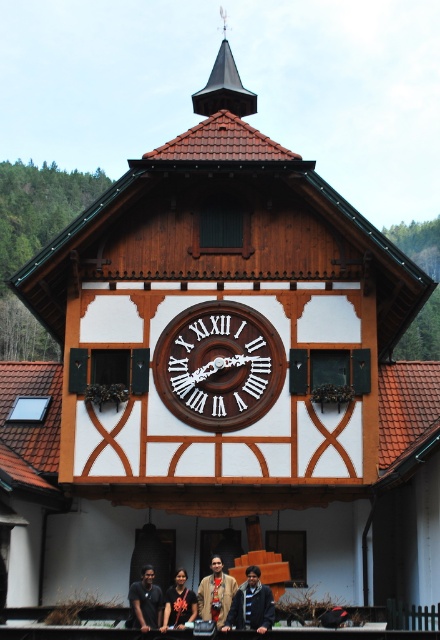
Question: Which is farther from the wooden clock at center?

Choices:
 (A) dark blue shirt at lower center
 (B) dark brown shirt at center
 (C) brown leather jacket at lower center
 (D) dark blue jacket at lower center

Answer: (B)

Question: Among these points, which one is nearest to the camera?

Choices:
 (A) (223, 624)
 (B) (260, 584)
 (C) (146, 572)
 (D) (249, 353)

Answer: (B)

Question: Does brown leather jacket at lower center appear on the right side of dark brown shirt at center?

Choices:
 (A) no
 (B) yes

Answer: (B)

Question: Considering the relative positions of dark brown shirt at center and dark blue shirt at lower center in the image provided, where is dark brown shirt at center located with respect to dark blue shirt at lower center?

Choices:
 (A) above
 (B) below

Answer: (B)

Question: Can you confirm if wooden clock at center is positioned above brown leather jacket at lower center?

Choices:
 (A) yes
 (B) no

Answer: (A)

Question: Which is nearer to the wooden clock at center?

Choices:
 (A) brown leather jacket at lower center
 (B) dark blue jacket at lower center
 (C) dark brown shirt at center

Answer: (A)